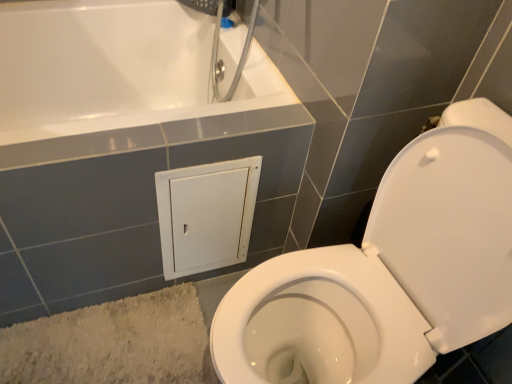
Question: Considering their positions, is white glossy toilet at lower right located in front of or behind beige textured bath mat at lower left?

Choices:
 (A) behind
 (B) front

Answer: (B)

Question: Do you think white glossy toilet at lower right is within beige textured bath mat at lower left, or outside of it?

Choices:
 (A) inside
 (B) outside

Answer: (B)

Question: From a real-world perspective, is white glossy toilet at lower right above or below beige textured bath mat at lower left?

Choices:
 (A) below
 (B) above

Answer: (B)

Question: Is beige textured bath mat at lower left bigger or smaller than white glossy toilet at lower right?

Choices:
 (A) big
 (B) small

Answer: (B)

Question: Considering the relative positions of beige textured bath mat at lower left and white glossy toilet at lower right in the image provided, is beige textured bath mat at lower left to the left or to the right of white glossy toilet at lower right?

Choices:
 (A) right
 (B) left

Answer: (B)

Question: From a real-world perspective, is beige textured bath mat at lower left positioned above or below white glossy toilet at lower right?

Choices:
 (A) above
 (B) below

Answer: (B)

Question: Choose the correct answer: Is beige textured bath mat at lower left inside white glossy toilet at lower right or outside it?

Choices:
 (A) outside
 (B) inside

Answer: (A)